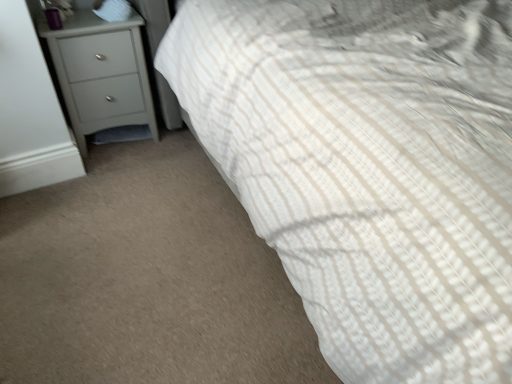
Question: Would you say matte gray chest of drawers at left is to the left or to the right of white soft pillow at upper left in the picture?

Choices:
 (A) right
 (B) left

Answer: (B)

Question: In the image, is matte gray chest of drawers at left positioned in front of or behind white soft pillow at upper left?

Choices:
 (A) front
 (B) behind

Answer: (A)

Question: From a real-world perspective, is matte gray chest of drawers at left above or below white soft pillow at upper left?

Choices:
 (A) above
 (B) below

Answer: (B)

Question: Is white soft pillow at upper left wider or thinner than matte gray chest of drawers at left?

Choices:
 (A) thin
 (B) wide

Answer: (A)

Question: In terms of height, does white soft pillow at upper left look taller or shorter compared to matte gray chest of drawers at left?

Choices:
 (A) tall
 (B) short

Answer: (B)

Question: Is white soft pillow at upper left inside the boundaries of matte gray chest of drawers at left, or outside?

Choices:
 (A) outside
 (B) inside

Answer: (A)

Question: From a real-world perspective, relative to matte gray chest of drawers at left, is white soft pillow at upper left vertically above or below?

Choices:
 (A) above
 (B) below

Answer: (A)